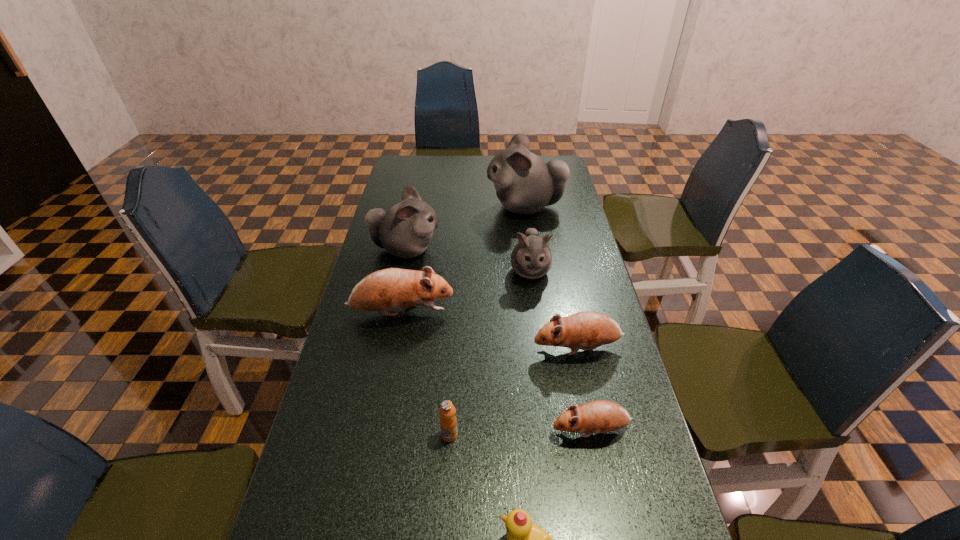
You are a GUI agent. You are given a task and a screenshot of the screen. Output one action in this format:
    pyautogui.click(x=<x>, y=<y>)
    Task: Click on the smallest brown hamster
    
    Given the screenshot: What is the action you would take?
    pyautogui.click(x=600, y=416)

Find the location of a particular element. the nearest brown hamster is located at coordinates (600, 416).

Find the location of a particular element. The image size is (960, 540). free region located on the face of the biggest white hamster is located at coordinates (385, 207).

Where is `vacant space located 0.380m on the face of the biggest white hamster`? vacant space located 0.380m on the face of the biggest white hamster is located at coordinates (388, 207).

What are the coordinates of `vacant space located 0.070m on the face of the biggest white hamster` in the screenshot? It's located at (468, 207).

Identify the location of free space located 0.160m on the face of the leftmost white hamster. (489, 249).

Locate an element on the screen. This screenshot has height=540, width=960. vacant space located on the face of the smallest white hamster is located at coordinates (540, 342).

Locate an element on the screen. The height and width of the screenshot is (540, 960). free space located at the face of the fourth farthest hamster is located at coordinates (499, 313).

Locate an element on the screen. The width and height of the screenshot is (960, 540). free space located at the face of the second nearest brown hamster is located at coordinates (457, 348).

I want to click on vacant space situated at the face of the second nearest brown hamster, so click(404, 348).